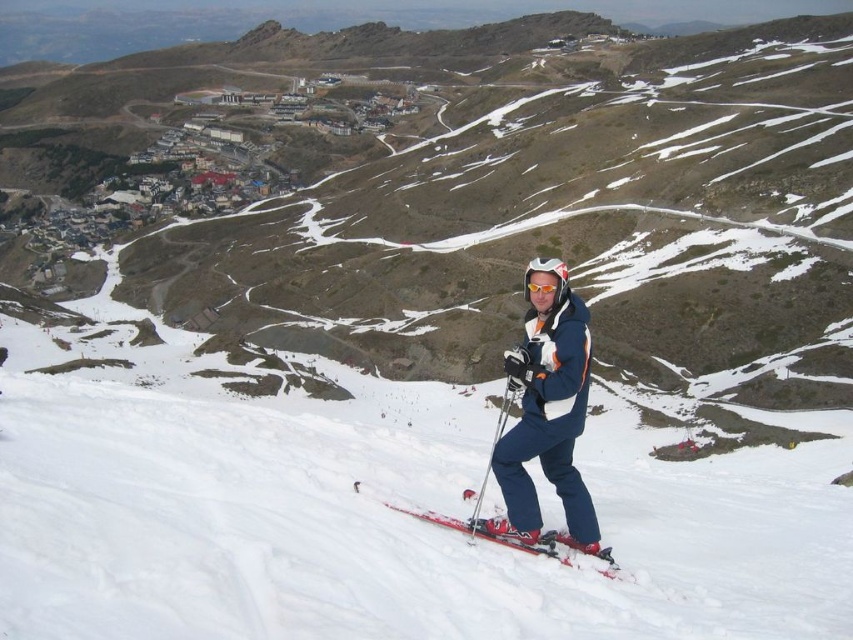
Question: Which object is the closest to the red matte skis at center?

Choices:
 (A) orange reflective goggles at center
 (B) white snow ski slope at center
 (C) blue fabric ski suit at center

Answer: (C)

Question: Can you confirm if blue fabric ski suit at center is wider than orange reflective goggles at center?

Choices:
 (A) yes
 (B) no

Answer: (A)

Question: Observing the image, what is the correct spatial positioning of white snow ski slope at center in reference to red matte skis at center?

Choices:
 (A) above
 (B) below

Answer: (B)

Question: Which of the following is the closest to the observer?

Choices:
 (A) (527, 513)
 (B) (621, 577)
 (C) (762, 504)
 (D) (558, 284)

Answer: (B)

Question: Is white snow ski slope at center wider than red matte skis at center?

Choices:
 (A) no
 (B) yes

Answer: (B)

Question: Which object appears closest to the camera in this image?

Choices:
 (A) orange reflective goggles at center
 (B) red matte skis at center
 (C) white snow ski slope at center

Answer: (C)